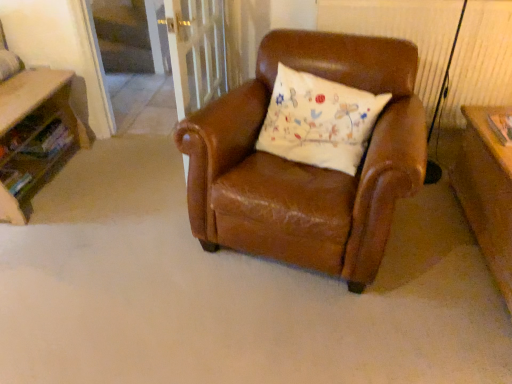
Question: From the image's perspective, relative to wooden table at left, is white embroidered pillow at center above or below?

Choices:
 (A) above
 (B) below

Answer: (A)

Question: From a real-world perspective, is white embroidered pillow at center above or below wooden table at left?

Choices:
 (A) above
 (B) below

Answer: (A)

Question: Which of these objects is positioned closest to the white embroidered pillow at center?

Choices:
 (A) clear glass screen door at upper center
 (B) wooden table at left

Answer: (B)

Question: Estimate the real-world distances between objects in this image. Which object is farther from the clear glass screen door at upper center?

Choices:
 (A) white embroidered pillow at center
 (B) wooden table at left

Answer: (A)